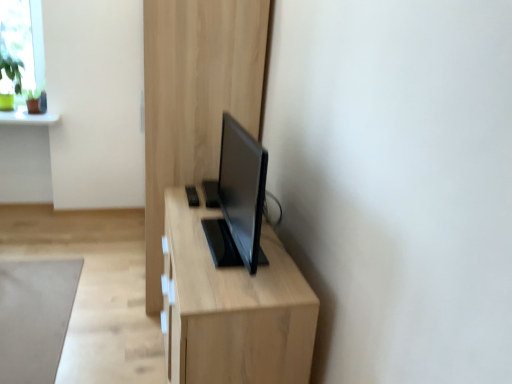
Question: From the image's perspective, does light wood dresser at center appear lower than light wood table at center?

Choices:
 (A) no
 (B) yes

Answer: (A)

Question: Is light wood table at center a part of light wood dresser at center?

Choices:
 (A) no
 (B) yes

Answer: (A)

Question: Is light wood dresser at center aimed at light wood table at center?

Choices:
 (A) no
 (B) yes

Answer: (A)

Question: Can you confirm if light wood dresser at center is smaller than light wood table at center?

Choices:
 (A) no
 (B) yes

Answer: (A)

Question: Would you say light wood dresser at center is outside light wood table at center?

Choices:
 (A) yes
 (B) no

Answer: (A)

Question: Can you confirm if light wood dresser at center is positioned to the right of light wood table at center?

Choices:
 (A) no
 (B) yes

Answer: (A)

Question: Is light wood table at center facing away from light wood dresser at center?

Choices:
 (A) yes
 (B) no

Answer: (B)

Question: Does light wood table at center have a greater width compared to light wood dresser at center?

Choices:
 (A) no
 (B) yes

Answer: (A)

Question: Is light wood table at center behind light wood dresser at center?

Choices:
 (A) no
 (B) yes

Answer: (A)

Question: Is light wood table at center taller than light wood dresser at center?

Choices:
 (A) yes
 (B) no

Answer: (B)

Question: Is light wood table at center at the left side of light wood dresser at center?

Choices:
 (A) yes
 (B) no

Answer: (B)

Question: From a real-world perspective, does light wood table at center sit lower than light wood dresser at center?

Choices:
 (A) no
 (B) yes

Answer: (B)

Question: From a real-world perspective, is gray matte rug at lower left on top of light wood dresser at center?

Choices:
 (A) no
 (B) yes

Answer: (A)